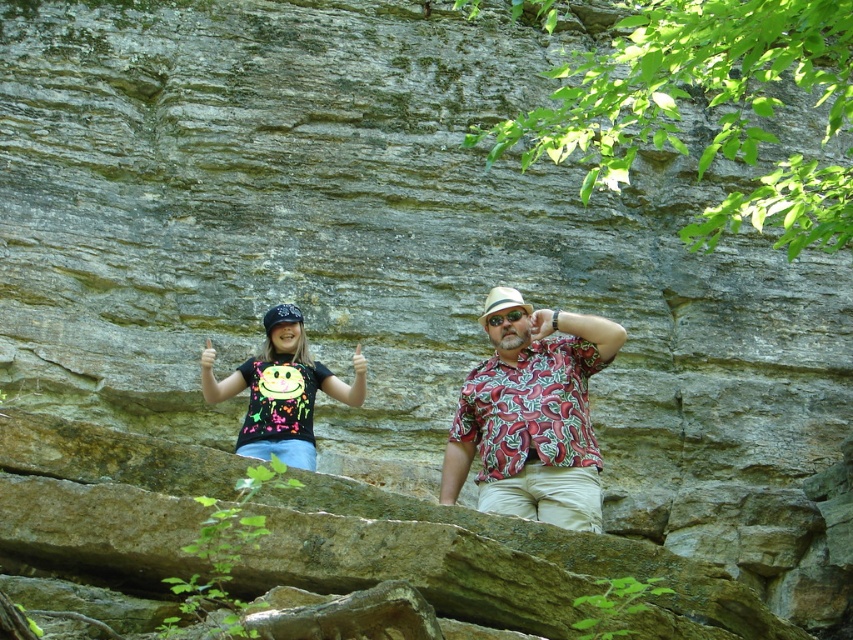
Based on the coordinates provided, which object is located at point (532, 413) in the image?

The point at (532, 413) corresponds to the black printed shirt at center.

You are a photographer trying to capture both the black printed shirt at center and the neon fabric shirt at lower left in a single frame. Which shirt should you adjust your camera angle to focus on first to ensure both fit in the frame?

The black printed shirt at center is wider than the neon fabric shirt at lower left, so you should focus on the black printed shirt at center first to ensure both fit in the frame.

You are standing at the point with coordinates point (x=207, y=392) and want to walk to the point with coordinates point (x=498, y=467). Which direction should you move relative to your current position?

You should move forward because point (x=498, y=467) is in front of point (x=207, y=392).